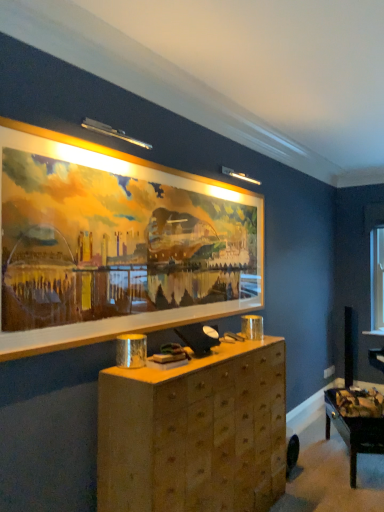
Question: Is wooden chest of drawers at center oriented towards wooden picture frame at upper center?

Choices:
 (A) no
 (B) yes

Answer: (A)

Question: From a real-world perspective, is wooden chest of drawers at center on top of wooden picture frame at upper center?

Choices:
 (A) yes
 (B) no

Answer: (B)

Question: Can you confirm if wooden chest of drawers at center is positioned to the left of wooden picture frame at upper center?

Choices:
 (A) no
 (B) yes

Answer: (A)

Question: Is wooden chest of drawers at center outside wooden picture frame at upper center?

Choices:
 (A) yes
 (B) no

Answer: (A)

Question: From a real-world perspective, is wooden chest of drawers at center positioned under wooden picture frame at upper center based on gravity?

Choices:
 (A) yes
 (B) no

Answer: (A)

Question: From a real-world perspective, is wooden chest of drawers at center above or below wooden table at lower right?

Choices:
 (A) below
 (B) above

Answer: (B)

Question: Visually, is wooden chest of drawers at center positioned to the left or to the right of wooden table at lower right?

Choices:
 (A) right
 (B) left

Answer: (B)

Question: Considering the positions of point pyautogui.click(x=233, y=436) and point pyautogui.click(x=336, y=421), is point pyautogui.click(x=233, y=436) closer or farther from the camera than point pyautogui.click(x=336, y=421)?

Choices:
 (A) farther
 (B) closer

Answer: (B)

Question: Is wooden chest of drawers at center wider or thinner than wooden table at lower right?

Choices:
 (A) thin
 (B) wide

Answer: (B)

Question: Does point (350, 470) appear closer or farther from the camera than point (377, 298)?

Choices:
 (A) farther
 (B) closer

Answer: (B)

Question: Is wooden table at lower right taller or shorter than transparent glass window at upper right?

Choices:
 (A) short
 (B) tall

Answer: (A)

Question: Considering their positions, is wooden table at lower right located in front of or behind transparent glass window at upper right?

Choices:
 (A) front
 (B) behind

Answer: (A)

Question: Visually, is wooden table at lower right positioned to the left or to the right of transparent glass window at upper right?

Choices:
 (A) right
 (B) left

Answer: (B)

Question: Relative to transparent glass window at upper right, is wooden picture frame at upper center in front or behind?

Choices:
 (A) front
 (B) behind

Answer: (A)

Question: From a real-world perspective, is wooden picture frame at upper center above or below transparent glass window at upper right?

Choices:
 (A) below
 (B) above

Answer: (B)